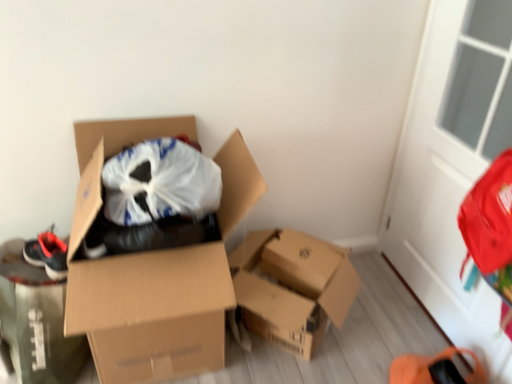
Question: Is white glass screen door at upper right shorter than cardboard box at center, the first box positioned from the left?

Choices:
 (A) yes
 (B) no

Answer: (B)

Question: Can you confirm if white glass screen door at upper right is positioned to the left of cardboard box at center, the second box from the right?

Choices:
 (A) no
 (B) yes

Answer: (A)

Question: Considering the relative sizes of white glass screen door at upper right and cardboard box at center, the second box from the right, in the image provided, is white glass screen door at upper right bigger than cardboard box at center, the second box from the right,?

Choices:
 (A) no
 (B) yes

Answer: (A)

Question: Considering the relative sizes of white glass screen door at upper right and cardboard box at center, the second box from the right, in the image provided, is white glass screen door at upper right taller than cardboard box at center, the second box from the right,?

Choices:
 (A) yes
 (B) no

Answer: (A)

Question: Would you say white glass screen door at upper right is a long distance from cardboard box at center, the first box positioned from the left?

Choices:
 (A) no
 (B) yes

Answer: (B)

Question: Is cardboard box at center, the second box from the right, at the back of white glass screen door at upper right?

Choices:
 (A) yes
 (B) no

Answer: (B)

Question: Does matte black shoe at left appear on the right side of cardboard box at center, the first box positioned from the left?

Choices:
 (A) yes
 (B) no

Answer: (B)

Question: From a real-world perspective, is matte black shoe at left located higher than cardboard box at center, the first box positioned from the left?

Choices:
 (A) yes
 (B) no

Answer: (B)

Question: From the image's perspective, is matte black shoe at left beneath cardboard box at center, the second box from the right?

Choices:
 (A) no
 (B) yes

Answer: (B)

Question: From a real-world perspective, is matte black shoe at left located beneath cardboard box at center, the first box positioned from the left?

Choices:
 (A) no
 (B) yes

Answer: (B)

Question: Is matte black shoe at left facing away from cardboard box at center, the second box from the right?

Choices:
 (A) no
 (B) yes

Answer: (A)

Question: Does matte black shoe at left have a larger size compared to cardboard box at center, the second box from the right?

Choices:
 (A) no
 (B) yes

Answer: (A)

Question: Considering the relative sizes of matte black shoe at left and cardboard box at center, acting as the first box starting from the right, in the image provided, is matte black shoe at left taller than cardboard box at center, acting as the first box starting from the right,?

Choices:
 (A) yes
 (B) no

Answer: (A)